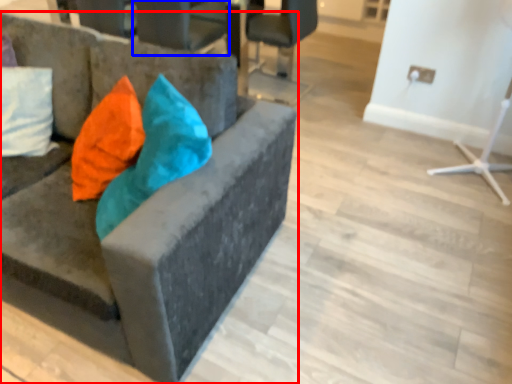
Question: Which of the following is the farthest to the observer, chair (highlighted by a red box) or chair (highlighted by a blue box)?

Choices:
 (A) chair
 (B) chair

Answer: (B)